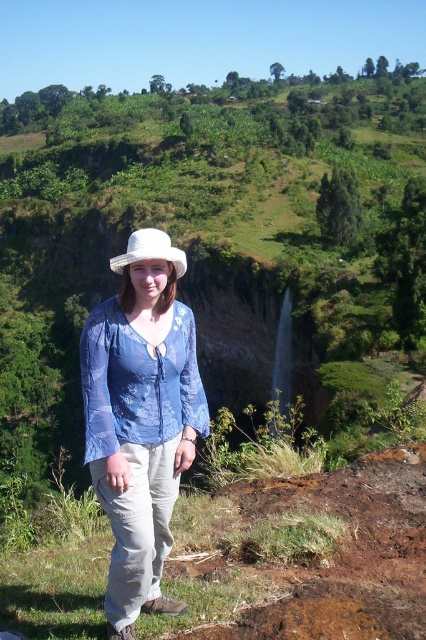
Question: Can you confirm if matte blue blouse at center is smaller than white woven hat at upper center?

Choices:
 (A) no
 (B) yes

Answer: (B)

Question: Does matte blue blouse at center appear on the right side of white woven hat at upper center?

Choices:
 (A) no
 (B) yes

Answer: (B)

Question: Can you confirm if matte blue blouse at center is positioned to the left of white woven hat at upper center?

Choices:
 (A) no
 (B) yes

Answer: (A)

Question: Which of the following is the closest to the observer?

Choices:
 (A) white woven hat at upper center
 (B) matte blue blouse at center

Answer: (B)

Question: Which of the following is the closest to the observer?

Choices:
 (A) matte blue blouse at center
 (B) white woven hat at upper center

Answer: (A)